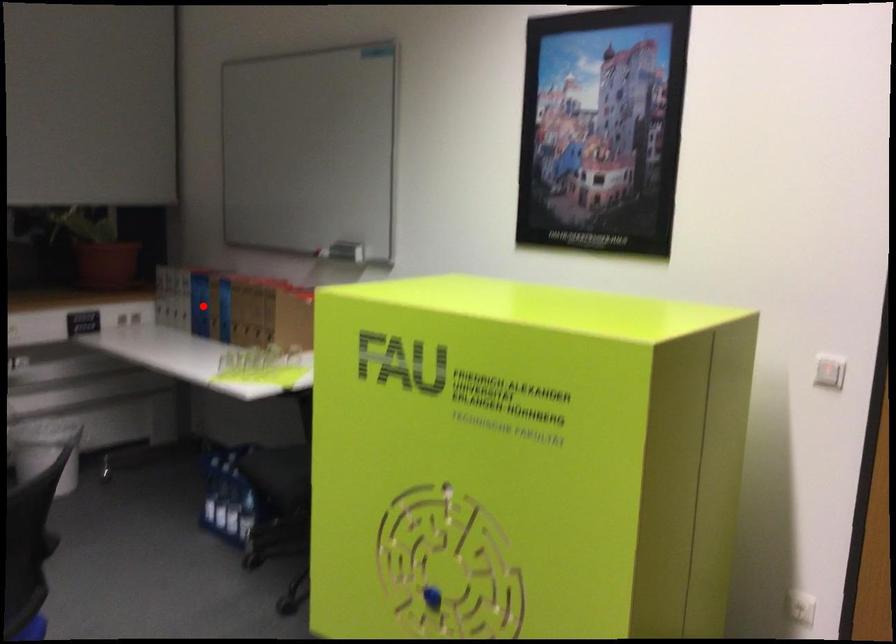
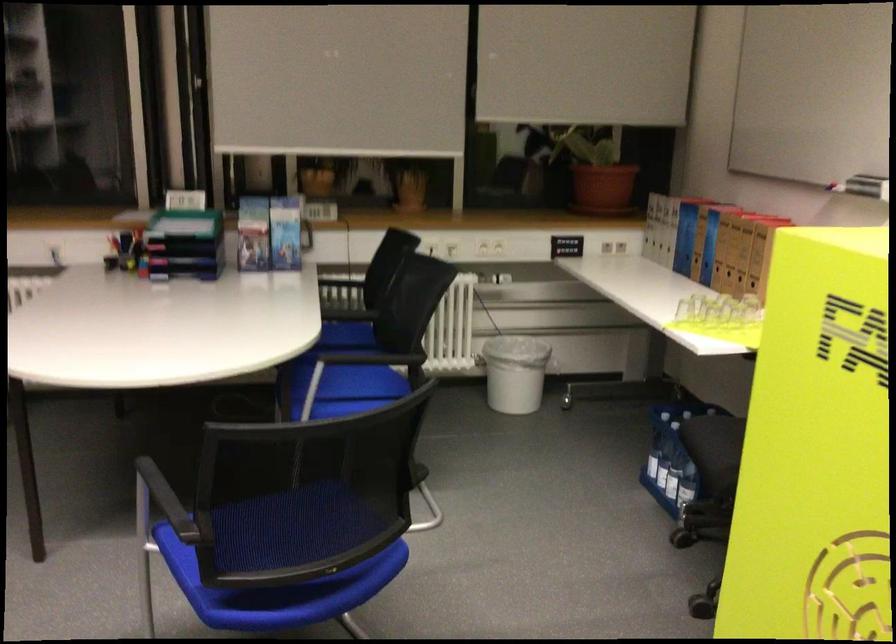
Question: I am providing you with two images of the same scene from different viewpoints. In image1, a red point is highlighted. Considering the same 3D point in image2, which of the following is correct?

Choices:
 (A) It is closer
 (B) It is farther

Answer: (A)